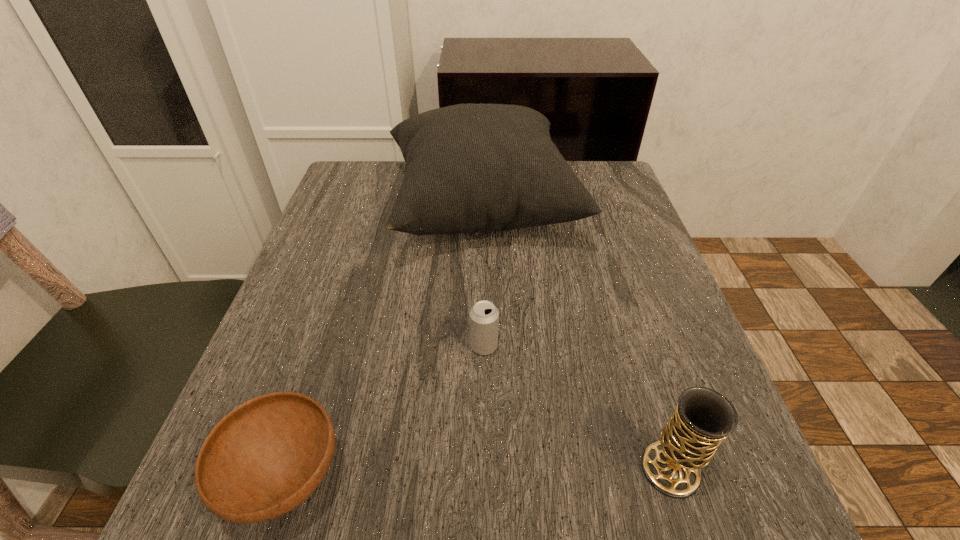
Find the location of a particular element. The width and height of the screenshot is (960, 540). free point between the third shortest object and the tallest object is located at coordinates (576, 340).

Identify the location of empty space that is in between the second farthest object and the farthest object. The image size is (960, 540). (483, 278).

Image resolution: width=960 pixels, height=540 pixels. I want to click on vacant area that lies between the cushion and the beer can, so [x=483, y=278].

Where is `free space that is in between the beer can and the second tallest object`? free space that is in between the beer can and the second tallest object is located at coordinates (577, 408).

Image resolution: width=960 pixels, height=540 pixels. I want to click on free space between the cushion and the third shortest object, so 576,340.

Point out which object is positioned as the nearest to the bowl. Please provide its 2D coordinates. Your answer should be formatted as a tuple, i.e. [(x, y)], where the tuple contains the x and y coordinates of a point satisfying the conditions above.

[(484, 316)]

At what (x,y) coordinates should I click in order to perform the action: click on object that stands as the second closest to the bowl. Please return your answer as a coordinate pair (x, y). Looking at the image, I should click on [470, 167].

Identify the location of free space that satisfies the following two spatial constraints: 1. on the front side of the chalice; 2. on the right side of the beer can. (485, 470).

Where is `vacant space that satisfies the following two spatial constraints: 1. on the front side of the chalice; 2. on the right side of the tallest object`? This screenshot has height=540, width=960. vacant space that satisfies the following two spatial constraints: 1. on the front side of the chalice; 2. on the right side of the tallest object is located at coordinates (483, 470).

Image resolution: width=960 pixels, height=540 pixels. I want to click on free space that satisfies the following two spatial constraints: 1. on the front side of the chalice; 2. on the left side of the cushion, so click(x=483, y=470).